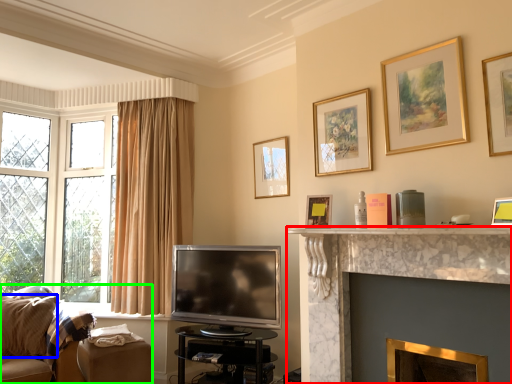
Question: Which is nearer to the fireplace (highlighted by a red box)? pillow (highlighted by a blue box) or studio couch (highlighted by a green box).

Choices:
 (A) pillow
 (B) studio couch

Answer: (B)